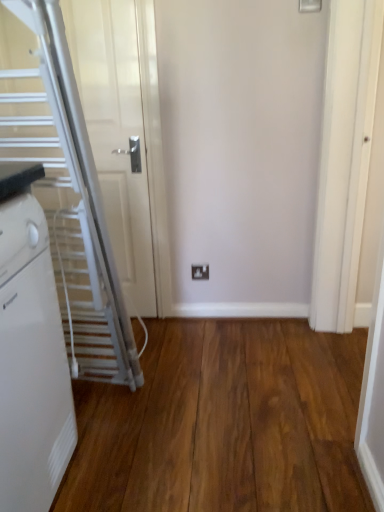
Question: Should I look upward or downward to see white plastic electric outlet at center?

Choices:
 (A) down
 (B) up

Answer: (A)

Question: Could you tell me if white metallic escalator at left is facing brown wood flooring at center?

Choices:
 (A) no
 (B) yes

Answer: (A)

Question: From a real-world perspective, is white metallic escalator at left located higher than brown wood flooring at center?

Choices:
 (A) no
 (B) yes

Answer: (B)

Question: From the image's perspective, does white metallic escalator at left appear higher than brown wood flooring at center?

Choices:
 (A) no
 (B) yes

Answer: (B)

Question: Does white metallic escalator at left have a larger size compared to brown wood flooring at center?

Choices:
 (A) yes
 (B) no

Answer: (A)

Question: Is white metallic escalator at left outside brown wood flooring at center?

Choices:
 (A) yes
 (B) no

Answer: (A)

Question: Considering the relative positions of white metallic escalator at left and brown wood flooring at center in the image provided, is white metallic escalator at left behind brown wood flooring at center?

Choices:
 (A) yes
 (B) no

Answer: (A)

Question: From the image's perspective, is white plastic electric outlet at center under brown wood flooring at center?

Choices:
 (A) yes
 (B) no

Answer: (B)

Question: Considering the relative sizes of white plastic electric outlet at center and brown wood flooring at center in the image provided, is white plastic electric outlet at center bigger than brown wood flooring at center?

Choices:
 (A) no
 (B) yes

Answer: (A)

Question: From a real-world perspective, is white plastic electric outlet at center on top of brown wood flooring at center?

Choices:
 (A) yes
 (B) no

Answer: (A)

Question: Are white plastic electric outlet at center and brown wood flooring at center beside each other?

Choices:
 (A) no
 (B) yes

Answer: (A)

Question: Is white plastic electric outlet at center smaller than brown wood flooring at center?

Choices:
 (A) yes
 (B) no

Answer: (A)

Question: Is white plastic electric outlet at center wider than brown wood flooring at center?

Choices:
 (A) no
 (B) yes

Answer: (A)

Question: Is white plastic radiator at left oriented away from white plastic electric outlet at center?

Choices:
 (A) no
 (B) yes

Answer: (A)